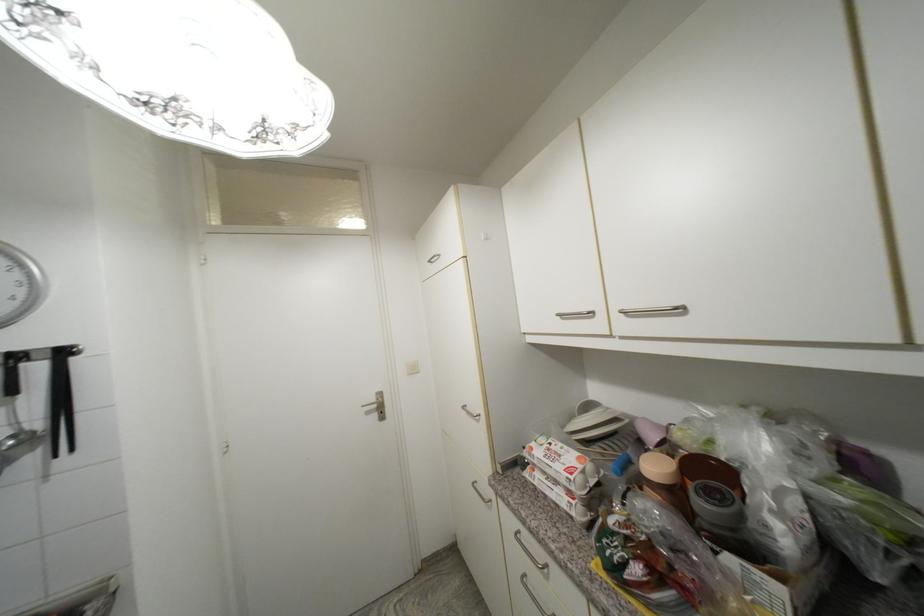
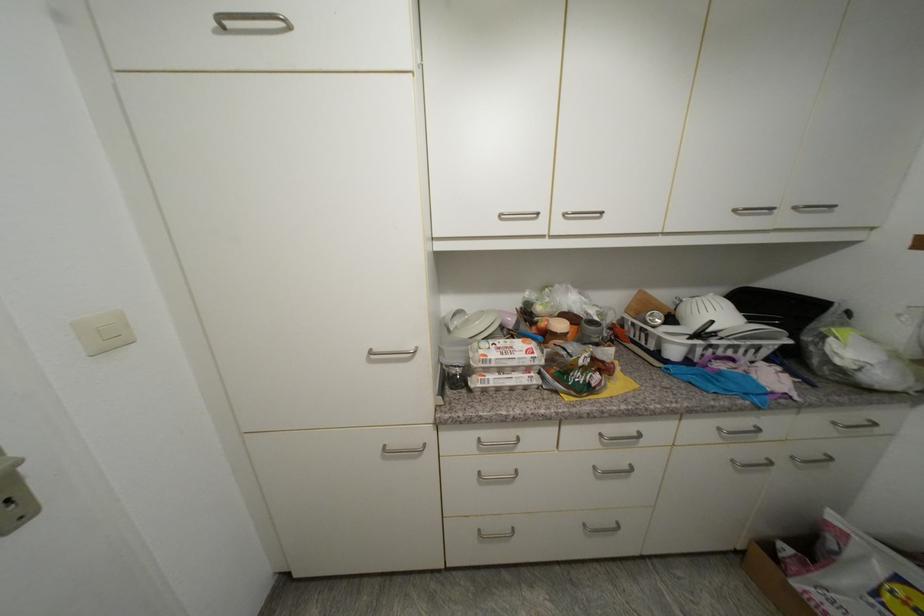
Find the pixel in the second image that matches (537,451) in the first image.

(492, 357)